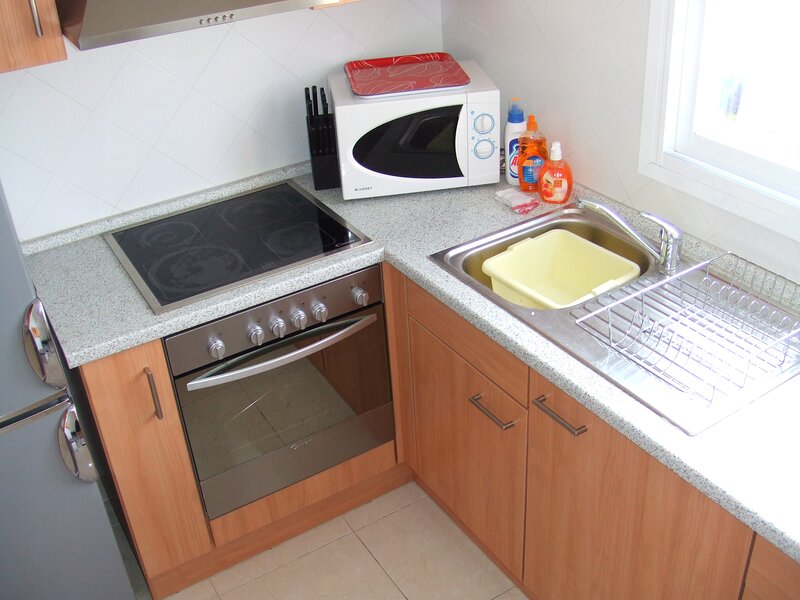
Where is `oven knob 5`? The height and width of the screenshot is (600, 800). oven knob 5 is located at coordinates (318, 313).